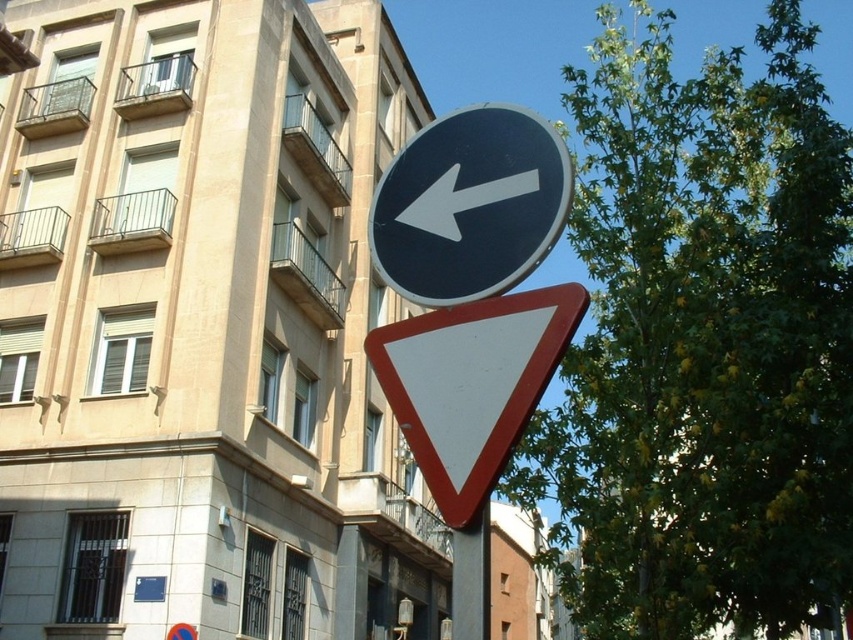
Is white plastic triangle at center smaller than metallic pole at center?

Yes.

Image resolution: width=853 pixels, height=640 pixels. What are the coordinates of `white plastic triangle at center` in the screenshot? It's located at (473, 385).

Can you confirm if white glossy arrow at upper center is positioned below metallic pole at center?

No.

What do you see at coordinates (461, 200) in the screenshot? I see `white glossy arrow at upper center` at bounding box center [461, 200].

Does point (506, 180) come farther from viewer compared to point (480, 520)?

That is True.

Locate an element on the screen. The image size is (853, 640). white glossy arrow at upper center is located at coordinates (461, 200).

Does green leafy tree at upper right come in front of black plastic sign at upper center?

No.

Is green leafy tree at upper right to the left of black plastic sign at upper center from the viewer's perspective?

In fact, green leafy tree at upper right is to the right of black plastic sign at upper center.

Describe the element at coordinates (703, 342) in the screenshot. I see `green leafy tree at upper right` at that location.

This screenshot has width=853, height=640. I want to click on green leafy tree at upper right, so click(x=703, y=342).